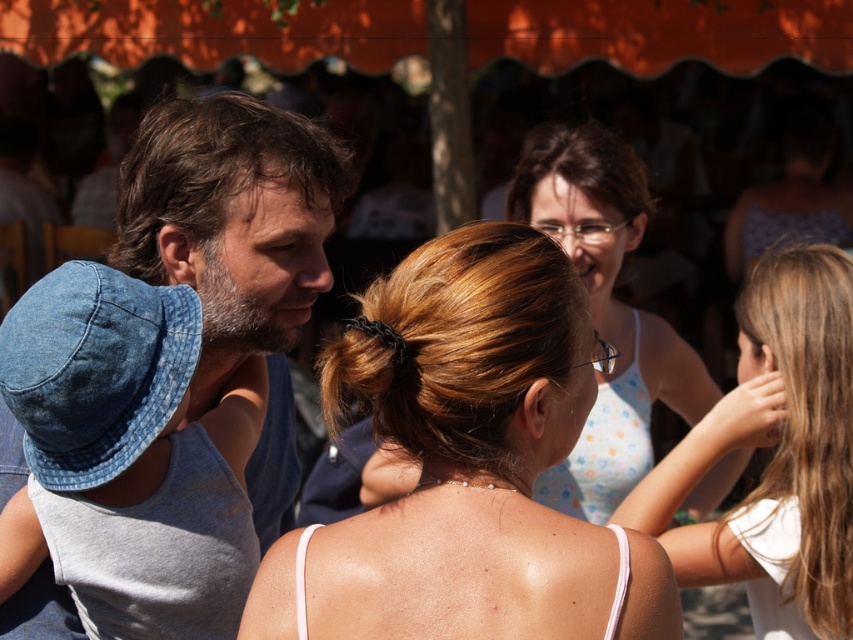
Question: Can you confirm if brownwoollyhair at center is positioned above white dotted fabric bikini top at upper center?

Choices:
 (A) no
 (B) yes

Answer: (B)

Question: Can you confirm if blonde hair at center is wider than denim hat at left?

Choices:
 (A) no
 (B) yes

Answer: (B)

Question: Which point is closer to the camera taking this photo?

Choices:
 (A) (488, 467)
 (B) (227, 164)
 (C) (790, 458)

Answer: (A)

Question: Which point is farther from the camera taking this photo?

Choices:
 (A) [x=296, y=538]
 (B) [x=592, y=138]
 (C) [x=637, y=477]
 (D) [x=378, y=300]

Answer: (B)

Question: Which point is closer to the camera taking this photo?

Choices:
 (A) (218, 141)
 (B) (161, 189)
 (C) (468, 396)

Answer: (C)

Question: Does brownhairbandhair at center appear over white dotted fabric bikini top at upper center?

Choices:
 (A) no
 (B) yes

Answer: (B)